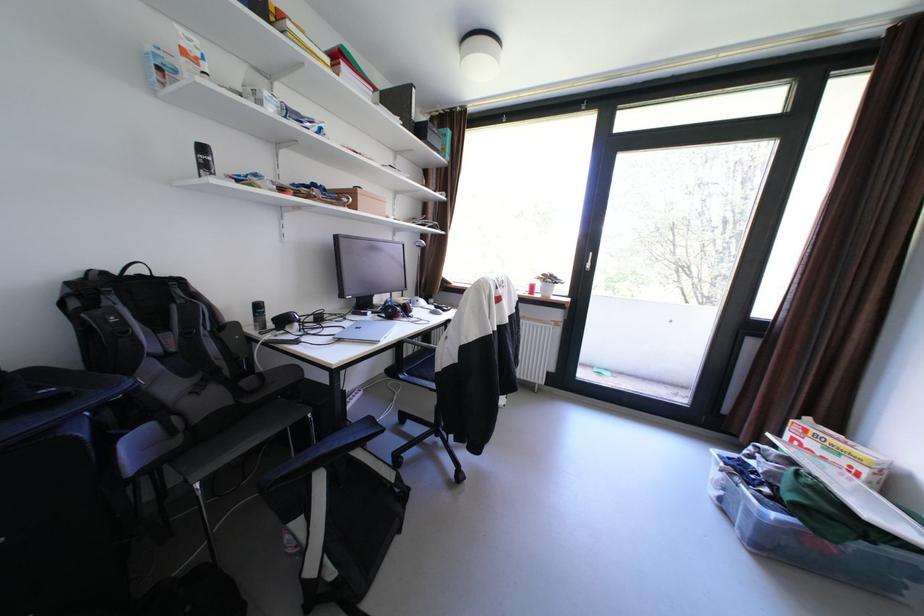
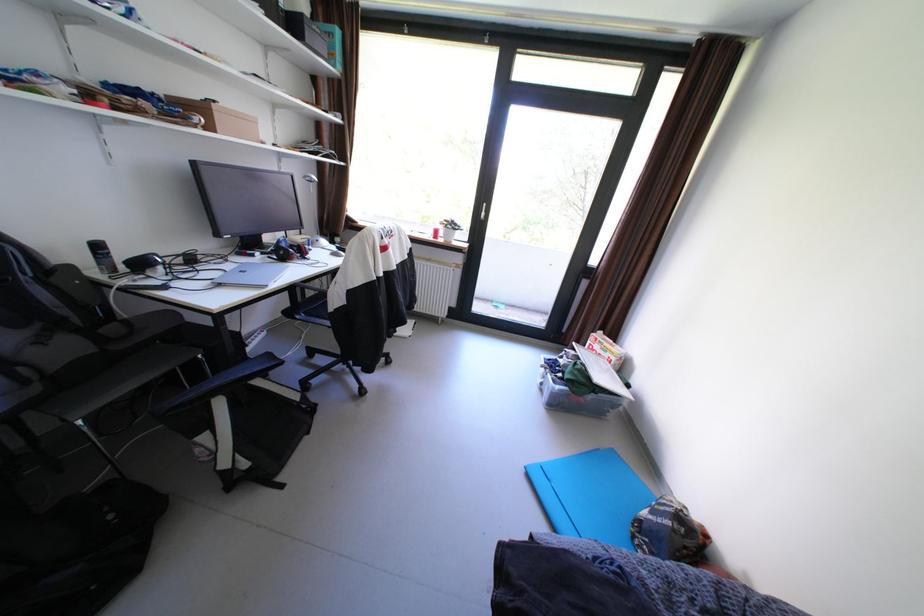
In the second image, find the point that corresponds to the point at 265,313 in the first image.

(106, 254)